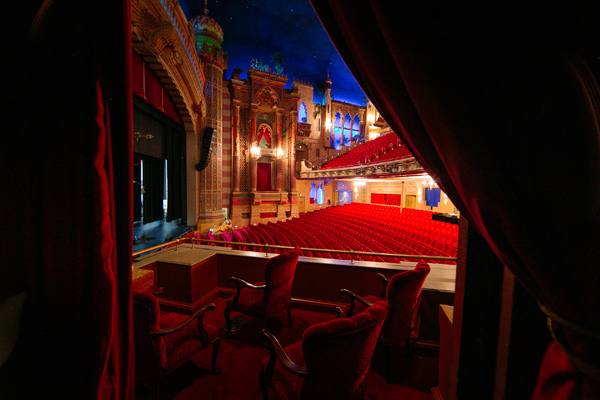
Find the location of `speaker`. speaker is located at coordinates (208, 139).